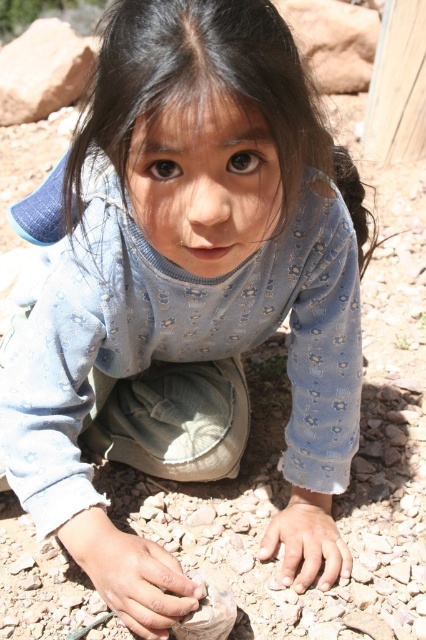
You are a photographer trying to capture a closeup of the child in this scene. You want to ensure that both the black silky hair at center and the smooth stone hand at lower center are in focus. Since the camera can only focus on one object at a time, which object should you prioritize focusing on to ensure the other remains in the background?

You should focus on the black silky hair at center because it is taller than the smooth stone hand at lower center, so the smooth stone hand will naturally be in the background and still in focus.

You are a photographer trying to capture the child in the image. To ensure the dirty sand at lower center is visible in the foreground, where should you position the camera relative to the child?

The dirty sand at lower center is located at point (131, 573), so positioning the camera slightly to the right and lower than the child would place the dirty sand at lower center in the foreground of the image.